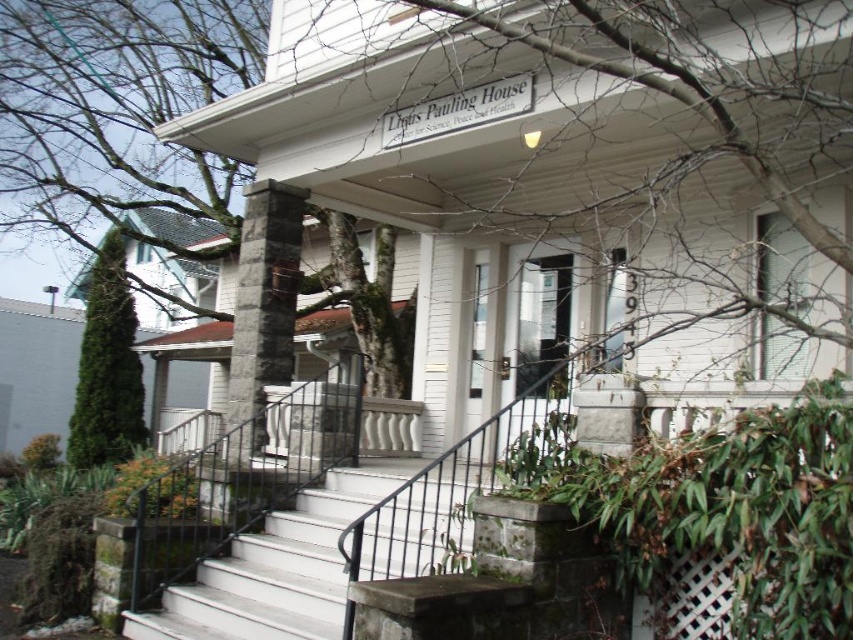
Does point (320, 611) lie behind point (111, 403)?

No, it is in front of (111, 403).

Can you confirm if white painted concrete stairs at center is positioned to the left of green coniferous tree at left?

In fact, white painted concrete stairs at center is to the right of green coniferous tree at left.

Which is in front, point (341, 604) or point (103, 406)?

Point (341, 604)

At what (x,y) coordinates should I click in order to perform the action: click on white painted concrete stairs at center. Please return your answer as a coordinate pair (x, y). Looking at the image, I should click on (277, 568).